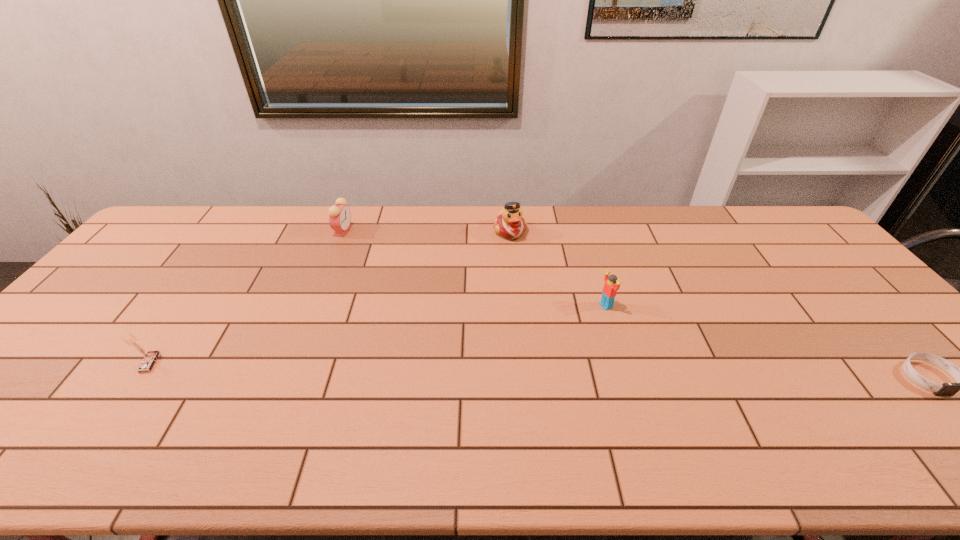
You are a GUI agent. You are given a task and a screenshot of the screen. Output one action in this format:
    pyautogui.click(x=<x>, y=<y>)
    Task: Click on the matchbox
    This screenshot has width=960, height=540.
    Given the screenshot: What is the action you would take?
    tap(149, 357)

This screenshot has height=540, width=960. Identify the location of the second object from right to left. (609, 291).

What are the coordinates of `the third nearest object` in the screenshot? It's located at (609, 291).

The image size is (960, 540). I want to click on the second object from left to right, so click(x=339, y=214).

Locate an element on the screen. The height and width of the screenshot is (540, 960). duck is located at coordinates (510, 224).

This screenshot has height=540, width=960. Find the location of `free region located on the back of the leftmost object`. free region located on the back of the leftmost object is located at coordinates tap(202, 291).

You are a GUI agent. You are given a task and a screenshot of the screen. Output one action in this format:
    pyautogui.click(x=<x>, y=<y>)
    Task: Click on the vacant region located 0.260m on the face of the fourth object from left to right
    Image resolution: width=960 pixels, height=540 pixels.
    Given the screenshot: What is the action you would take?
    pyautogui.click(x=523, y=344)

Locate an element on the screen. The image size is (960, 540). vacant region located 0.400m on the face of the fourth object from left to right is located at coordinates (475, 365).

This screenshot has width=960, height=540. Find the location of `free spot located on the face of the fourth object from left to right`. free spot located on the face of the fourth object from left to right is located at coordinates (542, 335).

At what (x,y) coordinates should I click in order to perform the action: click on vacant space located 0.110m on the face of the fourth object from right to left. Please return your answer as a coordinate pair (x, y). This screenshot has width=960, height=540. Looking at the image, I should click on pyautogui.click(x=361, y=252).